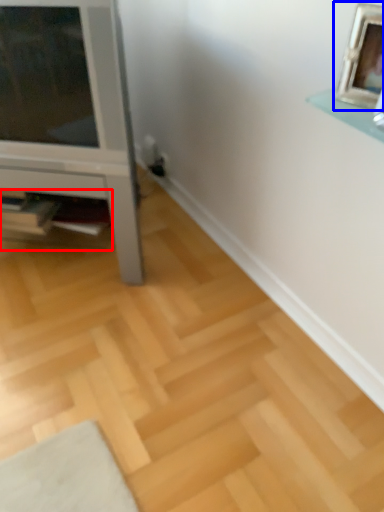
Question: Which object is further to the camera taking this photo, shelf (highlighted by a red box) or picture frame (highlighted by a blue box)?

Choices:
 (A) shelf
 (B) picture frame

Answer: (A)